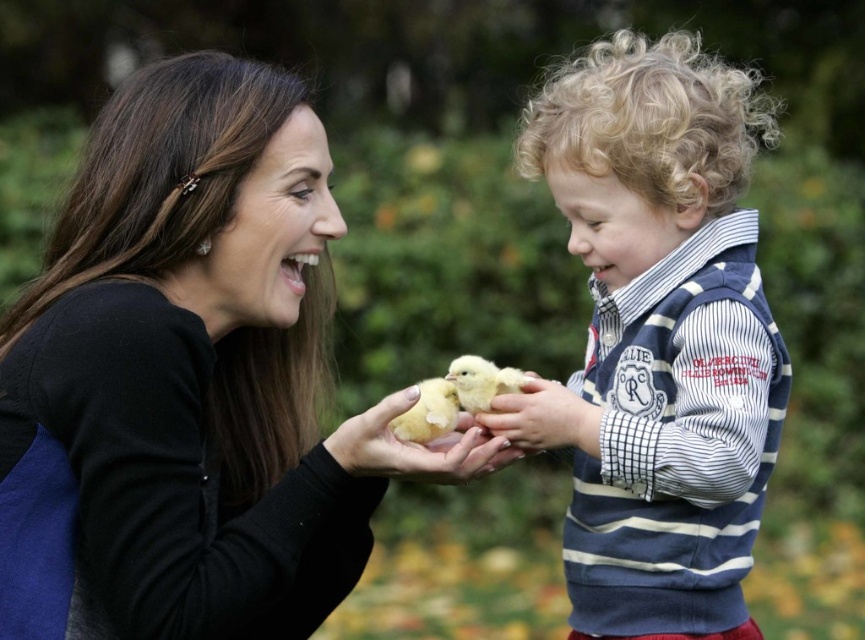
Question: Which object is closer to the camera taking this photo?

Choices:
 (A) soft yellow chick at center
 (B) soft yellow feathers at center

Answer: (A)

Question: Can you confirm if soft yellow chick at center is positioned below soft yellow feathers at center?

Choices:
 (A) no
 (B) yes

Answer: (A)

Question: Does soft yellow chick at center have a smaller size compared to yellow fluffy duckling at center?

Choices:
 (A) no
 (B) yes

Answer: (A)

Question: Which object is closer to the camera taking this photo?

Choices:
 (A) soft yellow chick at center
 (B) matte black sweater at center
 (C) soft yellow feathers at center
 (D) yellow fluffy duckling at center

Answer: (B)

Question: Does matte black sweater at center have a greater width compared to soft yellow chick at center?

Choices:
 (A) yes
 (B) no

Answer: (A)

Question: Considering the real-world distances, which object is farthest from the soft yellow chick at center?

Choices:
 (A) matte black sweater at center
 (B) soft yellow feathers at center

Answer: (A)